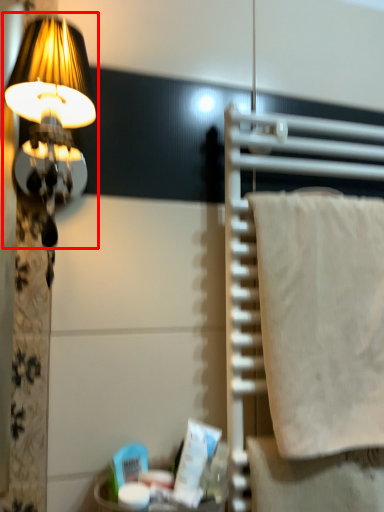
Question: From the image's perspective, what is the correct spatial relationship of lamp (annotated by the red box) in relation to wrap?

Choices:
 (A) above
 (B) below

Answer: (A)